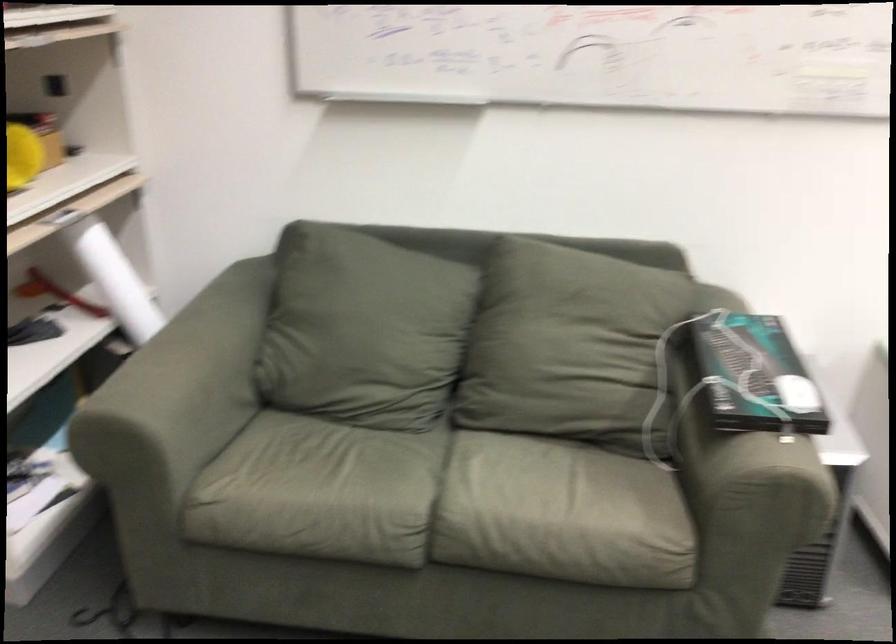
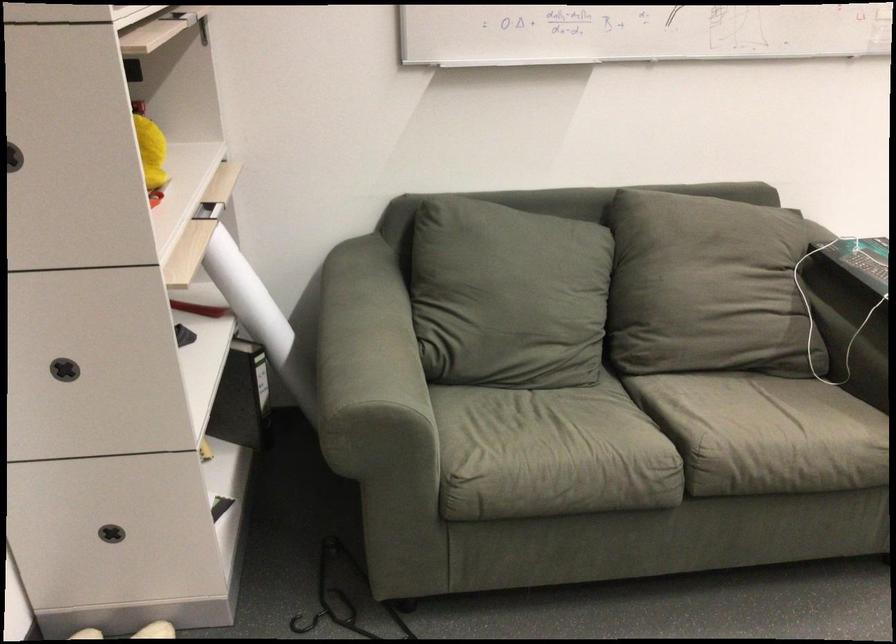
Where in the second image is the point corresponding to the point at 547,346 from the first image?

(707, 287)